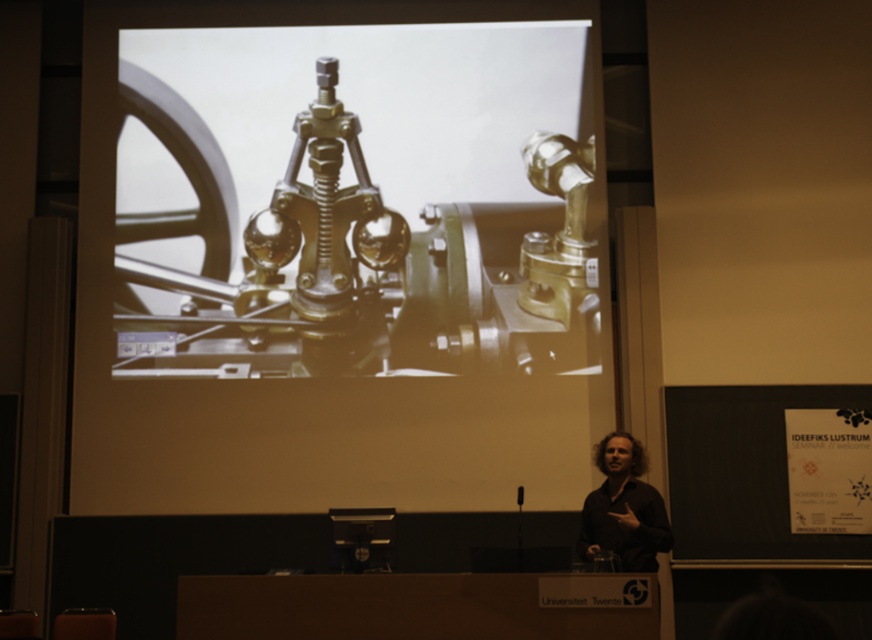
Question: Which object is farther from the camera taking this photo?

Choices:
 (A) dark brown hair at lower right
 (B) gold metallic machinery at center

Answer: (B)

Question: Which point is closer to the camera?

Choices:
 (A) (625, 445)
 (B) (475, 346)

Answer: (A)

Question: Can you confirm if gold metallic machinery at center is positioned to the right of dark brown hair at lower right?

Choices:
 (A) no
 (B) yes

Answer: (A)

Question: Which point is farther to the camera?

Choices:
 (A) gold metallic machinery at center
 (B) dark brown hair at lower right

Answer: (A)

Question: Is gold metallic machinery at center wider than dark brown hair at lower right?

Choices:
 (A) no
 (B) yes

Answer: (B)

Question: Does gold metallic machinery at center have a larger size compared to dark brown hair at lower right?

Choices:
 (A) no
 (B) yes

Answer: (B)